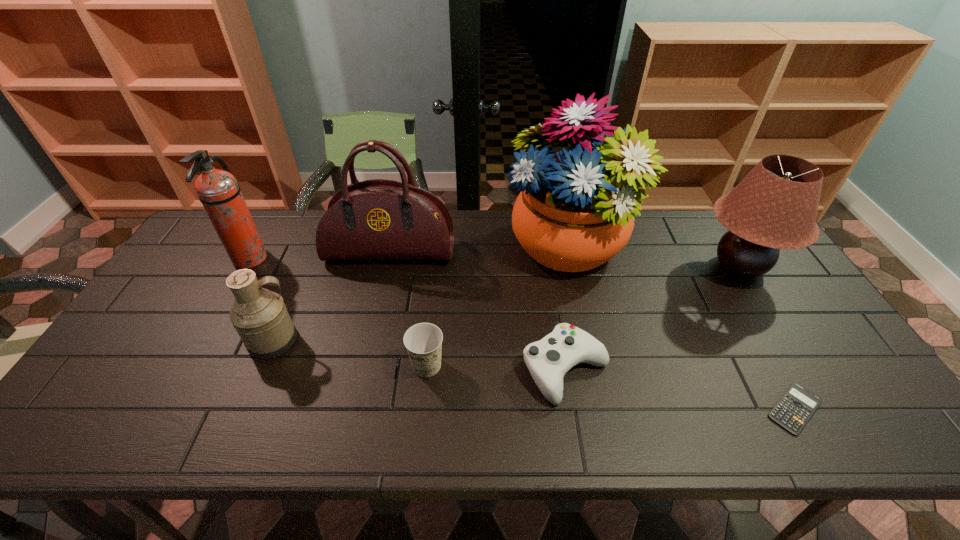
Identify the location of vacant region that satisfies the following two spatial constraints: 1. at the nozzle of the fire extinguisher; 2. on the right side of the seventh tallest object. (187, 369).